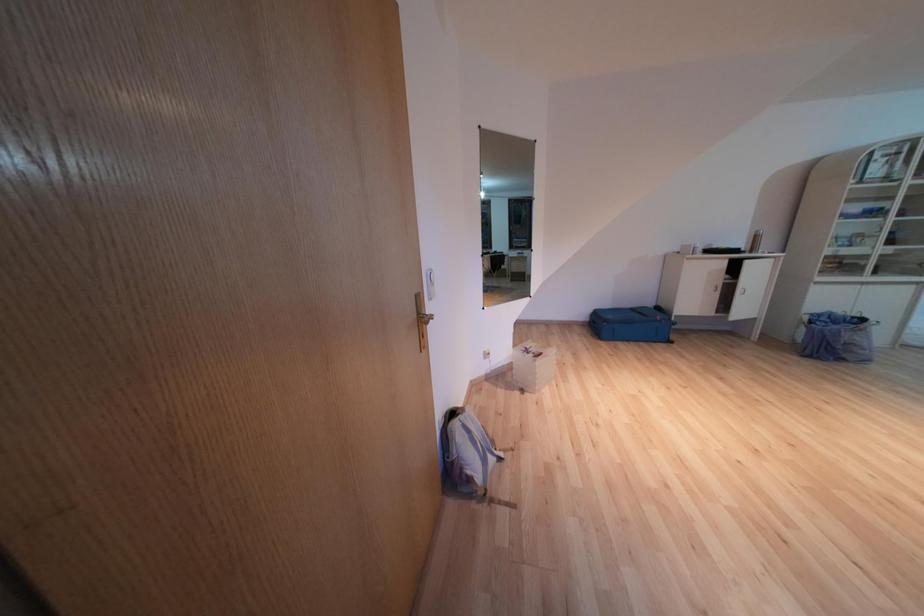
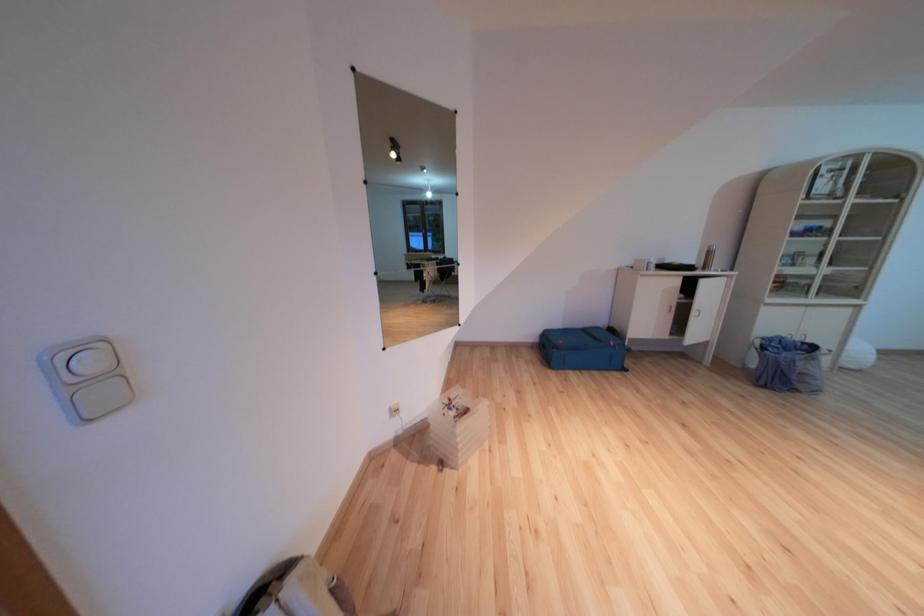
Question: The images are taken continuously from a first-person perspective. In which direction is your viewpoint rotating?

Choices:
 (A) Left
 (B) Right
 (C) Up
 (D) Down

Answer: (B)